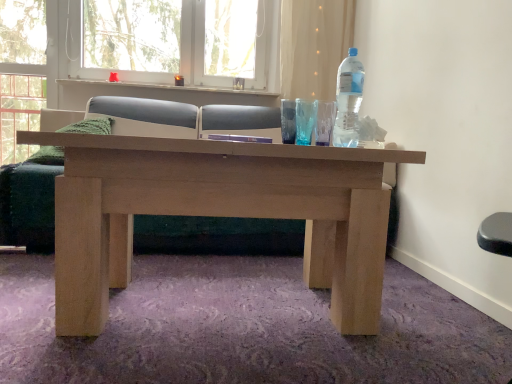
Question: Is white plastic window frame at upper center bigger or smaller than white textured window sill at upper center?

Choices:
 (A) big
 (B) small

Answer: (A)

Question: In terms of height, does white plastic window frame at upper center look taller or shorter compared to white textured window sill at upper center?

Choices:
 (A) short
 (B) tall

Answer: (B)

Question: Considering the real-world distances, which object is closest to the transparent plastic bottle at upper right?

Choices:
 (A) white textured window sill at upper center
 (B) matte wood couch at center
 (C) white plastic window frame at upper center
 (D) translucent fabric curtain at upper center

Answer: (D)

Question: Which object is positioned closest to the transparent plastic bottle at upper right?

Choices:
 (A) matte wood couch at center
 (B) translucent fabric curtain at upper center
 (C) white plastic window frame at upper center
 (D) white textured window sill at upper center

Answer: (B)